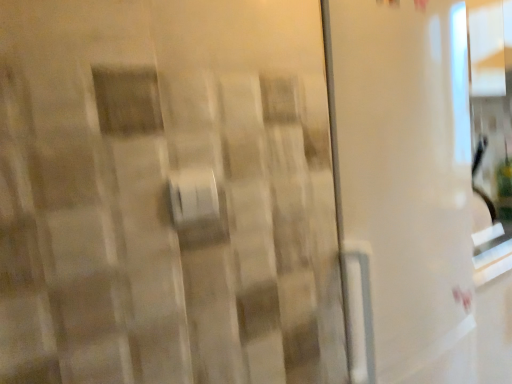
Question: Can you confirm if white plastic towel bar at center is thinner than transparent plastic screen door at center?

Choices:
 (A) yes
 (B) no

Answer: (A)

Question: From the image's perspective, is white plastic towel bar at center beneath transparent plastic screen door at center?

Choices:
 (A) yes
 (B) no

Answer: (B)

Question: Can you confirm if white plastic towel bar at center is bigger than transparent plastic screen door at center?

Choices:
 (A) no
 (B) yes

Answer: (A)

Question: Is white plastic towel bar at center shorter than transparent plastic screen door at center?

Choices:
 (A) yes
 (B) no

Answer: (A)

Question: Can you confirm if white plastic towel bar at center is taller than transparent plastic screen door at center?

Choices:
 (A) no
 (B) yes

Answer: (A)

Question: Is the position of white plastic towel bar at center more distant than that of transparent plastic screen door at center?

Choices:
 (A) no
 (B) yes

Answer: (A)

Question: Is transparent plastic screen door at center further to the viewer compared to white plastic towel bar at center?

Choices:
 (A) no
 (B) yes

Answer: (B)

Question: Considering the relative sizes of transparent plastic screen door at center and white plastic towel bar at center in the image provided, is transparent plastic screen door at center shorter than white plastic towel bar at center?

Choices:
 (A) yes
 (B) no

Answer: (B)

Question: Considering the relative sizes of transparent plastic screen door at center and white plastic towel bar at center in the image provided, is transparent plastic screen door at center wider than white plastic towel bar at center?

Choices:
 (A) yes
 (B) no

Answer: (A)

Question: Is transparent plastic screen door at center turned away from white plastic towel bar at center?

Choices:
 (A) no
 (B) yes

Answer: (A)

Question: From a real-world perspective, is transparent plastic screen door at center on top of white plastic towel bar at center?

Choices:
 (A) yes
 (B) no

Answer: (B)

Question: From the image's perspective, is transparent plastic screen door at center located above white plastic towel bar at center?

Choices:
 (A) no
 (B) yes

Answer: (A)

Question: In the image, is white plastic towel bar at center on the left side or the right side of transparent plastic screen door at center?

Choices:
 (A) left
 (B) right

Answer: (A)